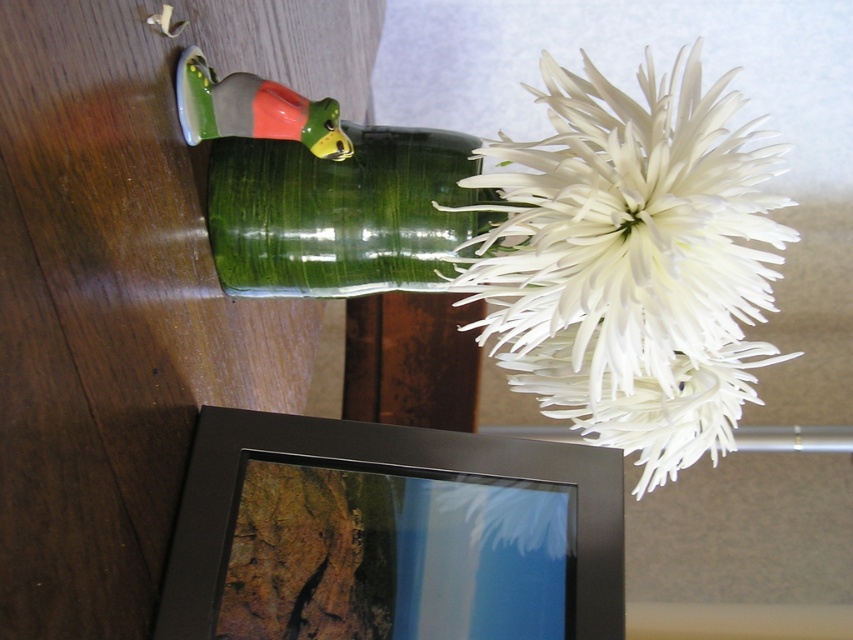
You are standing in front of the decorative arrangement and want to place a small ornament between the two points, point (631, 451) and point (328, 561). Which point is closer to you so you can place the ornament appropriately?

Point (631, 451) is closer to you than point (328, 561), so you should place the ornament near that point first.

Consider the image. You are a florist arranging flowers and need to place a new decoration between the white matte flower at upper right and the green glass vase at upper center. The decoration must be exactly 5 inches away from both objects. Is this possible?

The white matte flower at upper right and green glass vase at upper center are 5.14 inches apart. Since 5 inches is less than 5.14 inches, you can place the decoration 2.57 inches away from each object, maintaining equal distance from both.

Looking at this image, you are a florist preparing to place a protective cover over the white matte flower at upper right. The cover you have is 24 inches in length. Based on the scene, can the cover fit over the flower?

The white matte flower at upper right is 25.84 inches from viewer, which is longer than the 24 inches cover. Therefore, the cover is not long enough to fit over the white matte flower at upper right.